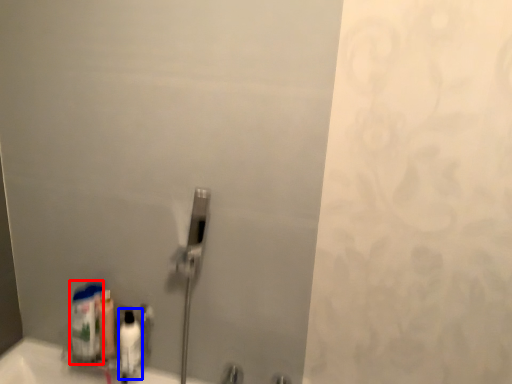
Question: Which point is closer to the camera, cleaning product (highlighted by a red box) or mouthwash (highlighted by a blue box)?

Choices:
 (A) cleaning product
 (B) mouthwash

Answer: (B)